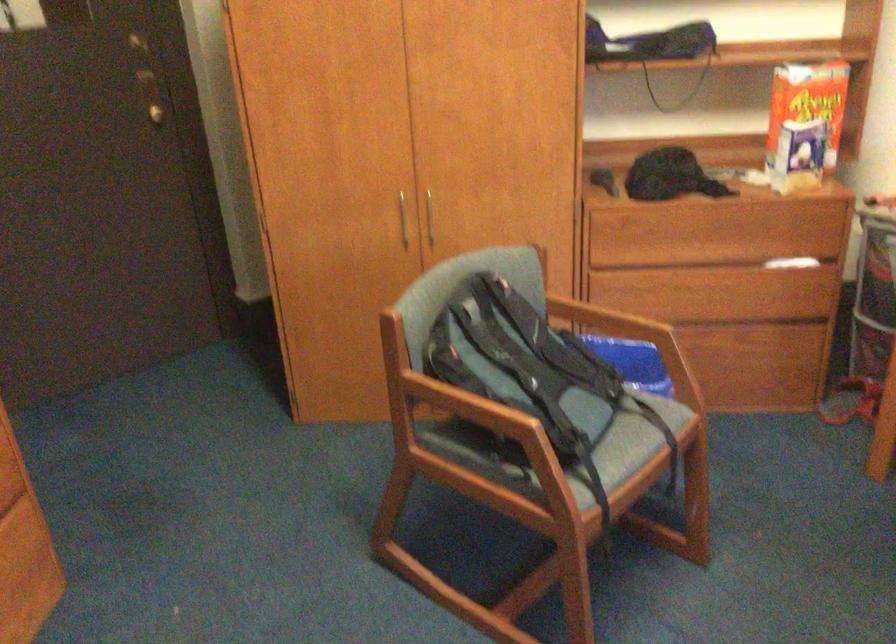
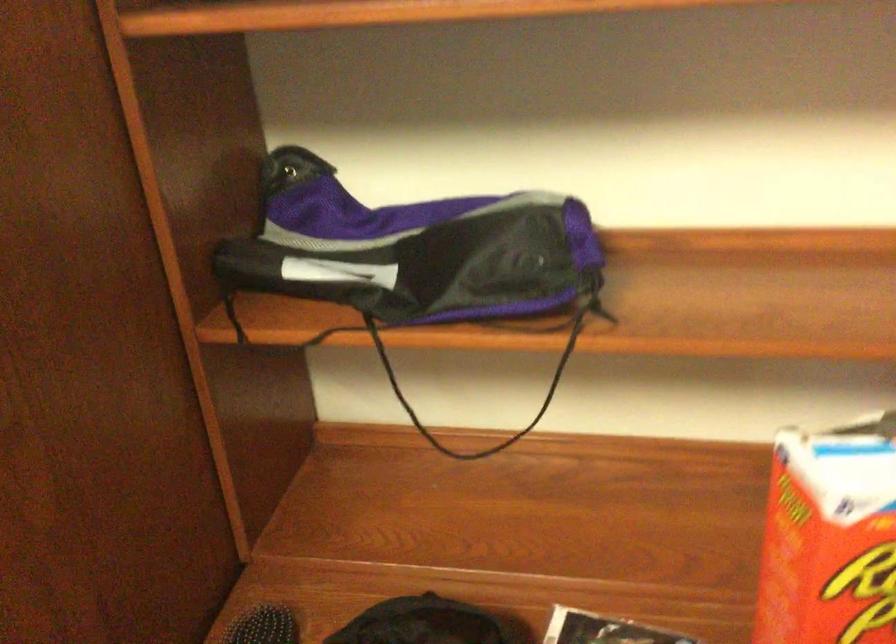
Which direction would the cameraman need to move to produce the second image?

The cameraman walked toward right, forward.